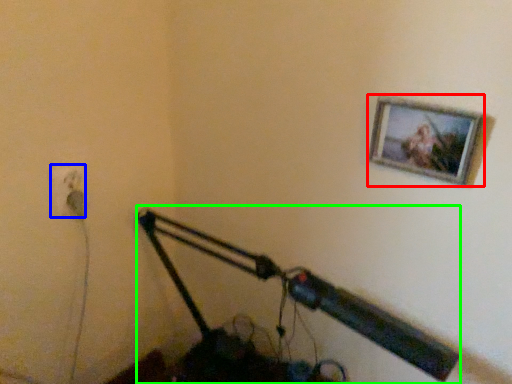
Question: Estimate the real-world distances between objects in this image. Which object is farther from picture frame (highlighted by a red box), electric outlet (highlighted by a blue box) or lamp (highlighted by a green box)?

Choices:
 (A) electric outlet
 (B) lamp

Answer: (A)